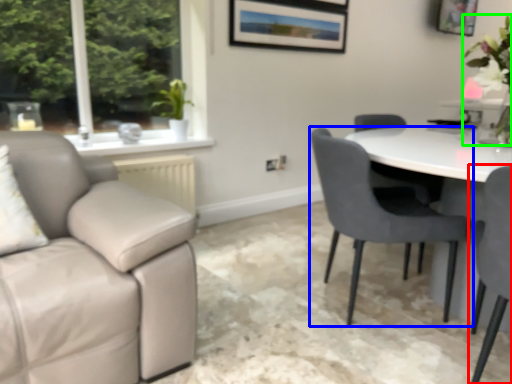
Question: Which object is positioned farthest from chair (highlighted by a red box)? Select from chair (highlighted by a blue box) and floral arrangement (highlighted by a green box).

Choices:
 (A) chair
 (B) floral arrangement

Answer: (B)